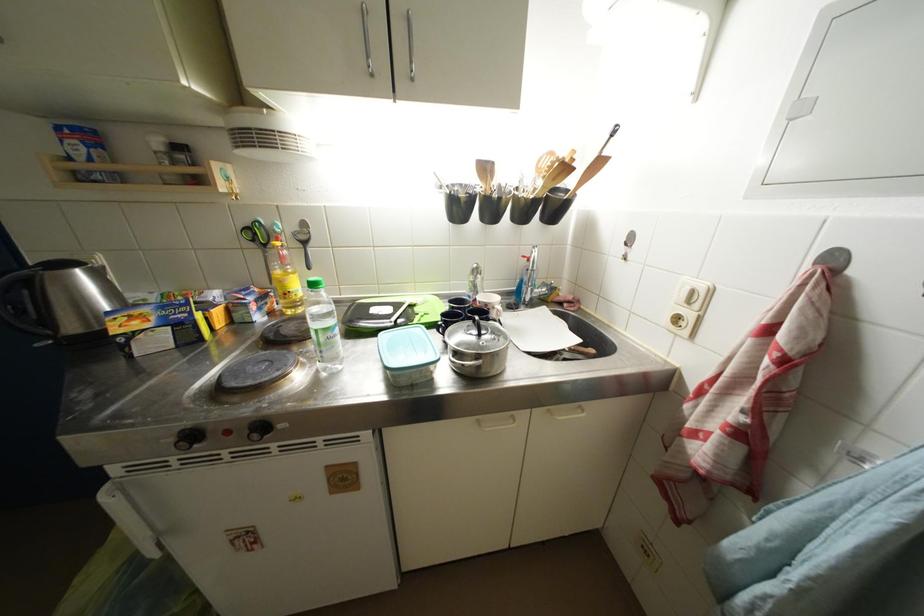
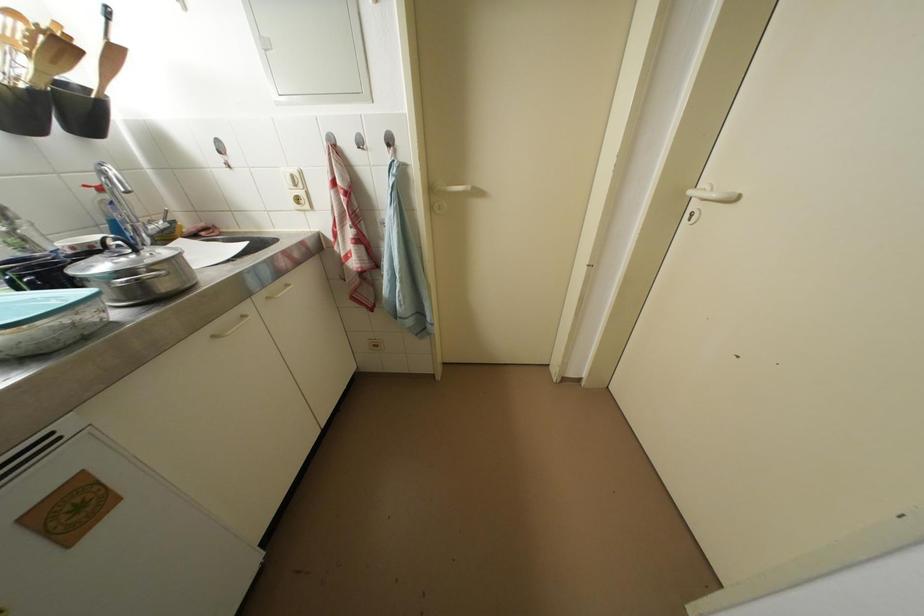
Locate, in the second image, the point that corresponds to pixel 572 172 in the first image.

(69, 50)